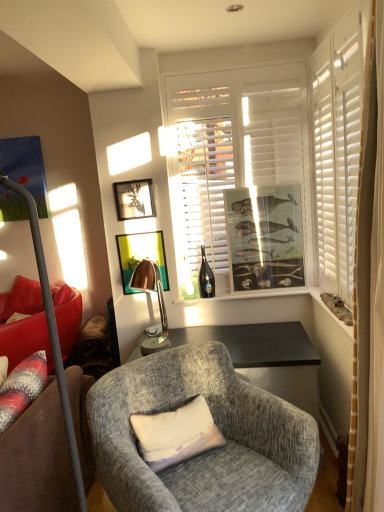
Locate an element on the screen. Image resolution: width=384 pixels, height=512 pixels. blank space situated above matte glass window sill at center, the first window sill viewed from the left (from a real-world perspective) is located at coordinates (244, 290).